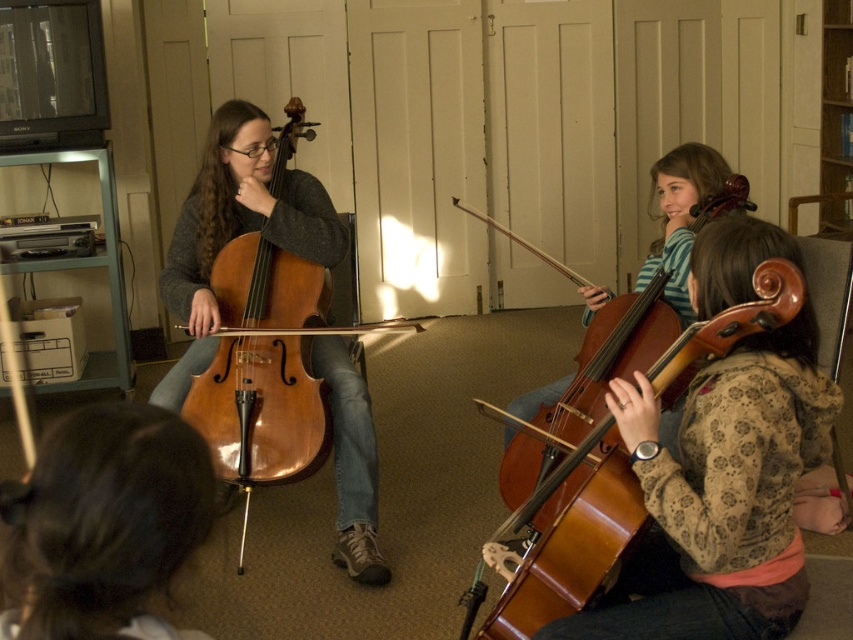
You are a music student who needs to retrieve a music sheet from the wooden bookshelf at upper right while playing the wooden violin at center. Can you reach it without moving from your current position?

The wooden violin at center is 2.71 meters away from the wooden bookshelf at upper right. Since the average person cannot reach that distance while playing the violin, you would need to move closer or ask for assistance.

You are a music student who wants to reach the wooden bookshelf at upper right to get a music sheet. The wooden violin at center is in your way. Can you move the violin to access the bookshelf?

The wooden violin at center is positioned under the wooden bookshelf at upper right, so you can move the violin to access the bookshelf.